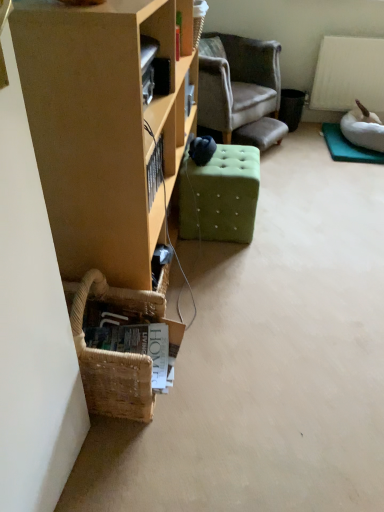
Question: From the image's perspective, is green tufted ottoman at center located beneath matte wood cabinet at left?

Choices:
 (A) no
 (B) yes

Answer: (B)

Question: From a real-world perspective, is green tufted ottoman at center positioned under matte wood cabinet at left based on gravity?

Choices:
 (A) yes
 (B) no

Answer: (A)

Question: Can you confirm if green tufted ottoman at center is shorter than matte wood cabinet at left?

Choices:
 (A) yes
 (B) no

Answer: (A)

Question: Is matte wood cabinet at left at the back of green tufted ottoman at center?

Choices:
 (A) no
 (B) yes

Answer: (B)

Question: Is green tufted ottoman at center at the right side of matte wood cabinet at left?

Choices:
 (A) yes
 (B) no

Answer: (A)

Question: Considering their positions, is velvet gray armchair at center located in front of or behind green tufted ottoman at center?

Choices:
 (A) behind
 (B) front

Answer: (A)

Question: Is velvet gray armchair at center taller or shorter than green tufted ottoman at center?

Choices:
 (A) short
 (B) tall

Answer: (B)

Question: Is point (230, 106) closer or farther from the camera than point (218, 224)?

Choices:
 (A) closer
 (B) farther

Answer: (B)

Question: From the image's perspective, is velvet gray armchair at center located above or below green tufted ottoman at center?

Choices:
 (A) above
 (B) below

Answer: (A)

Question: From a real-world perspective, relative to velvet gray armchair at center, is green tufted ottoman at center vertically above or below?

Choices:
 (A) below
 (B) above

Answer: (A)

Question: Is green tufted ottoman at center inside or outside of velvet gray armchair at center?

Choices:
 (A) inside
 (B) outside

Answer: (B)

Question: From the image's perspective, is green tufted ottoman at center above or below velvet gray armchair at center?

Choices:
 (A) above
 (B) below

Answer: (B)

Question: Is green tufted ottoman at center in front of or behind velvet gray armchair at center in the image?

Choices:
 (A) front
 (B) behind

Answer: (A)

Question: Considering the positions of point (271, 66) and point (84, 62), is point (271, 66) closer or farther from the camera than point (84, 62)?

Choices:
 (A) closer
 (B) farther

Answer: (B)

Question: Based on their positions, is velvet gray armchair at center located to the left or right of matte wood cabinet at left?

Choices:
 (A) right
 (B) left

Answer: (A)